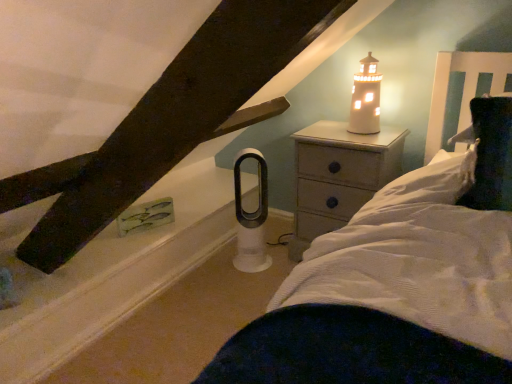
The width and height of the screenshot is (512, 384). I want to click on free spot above wooden nightstand at upper right (from a real-world perspective), so click(350, 136).